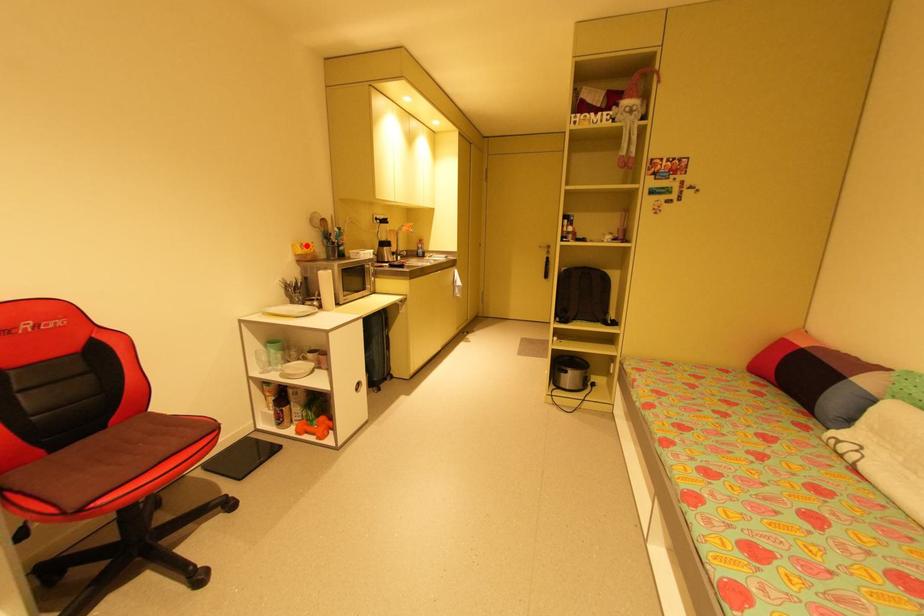
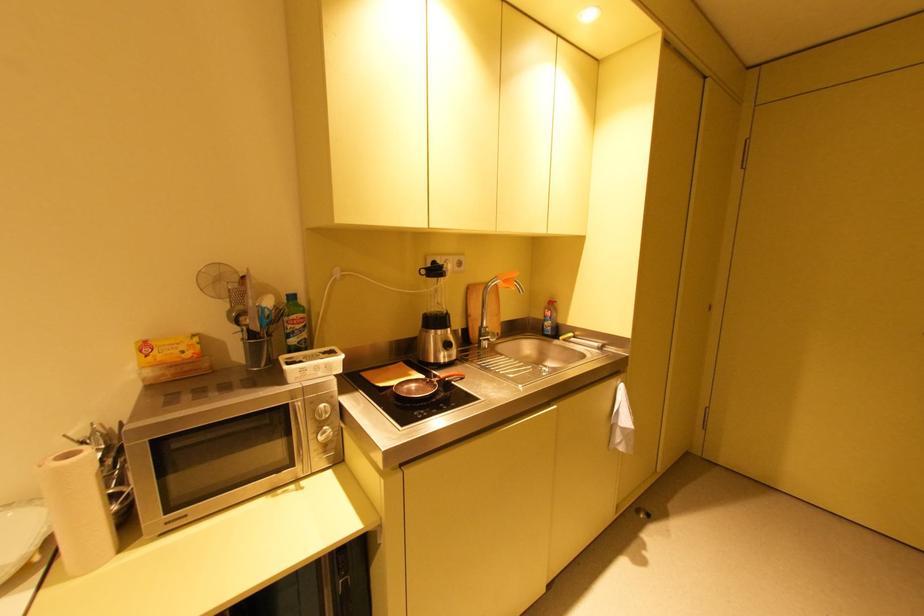
In the second image, find the point that corresponds to the highlighted location in the first image.

(150, 347)